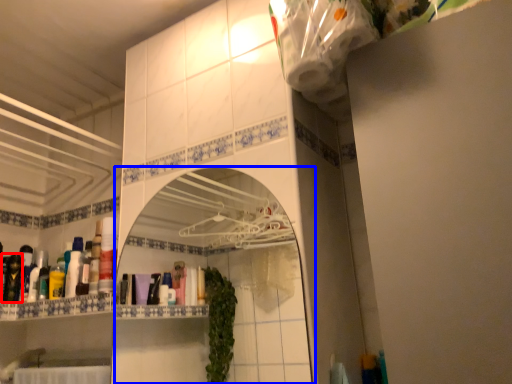
Question: Which object is further to the camera taking this photo, toiletry (highlighted by a red box) or mirror (highlighted by a blue box)?

Choices:
 (A) toiletry
 (B) mirror

Answer: (A)